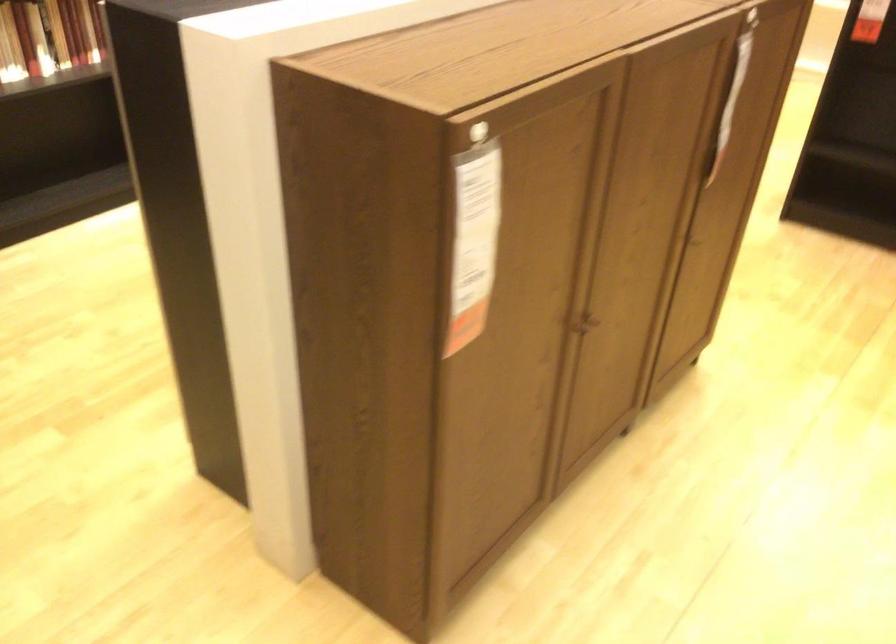
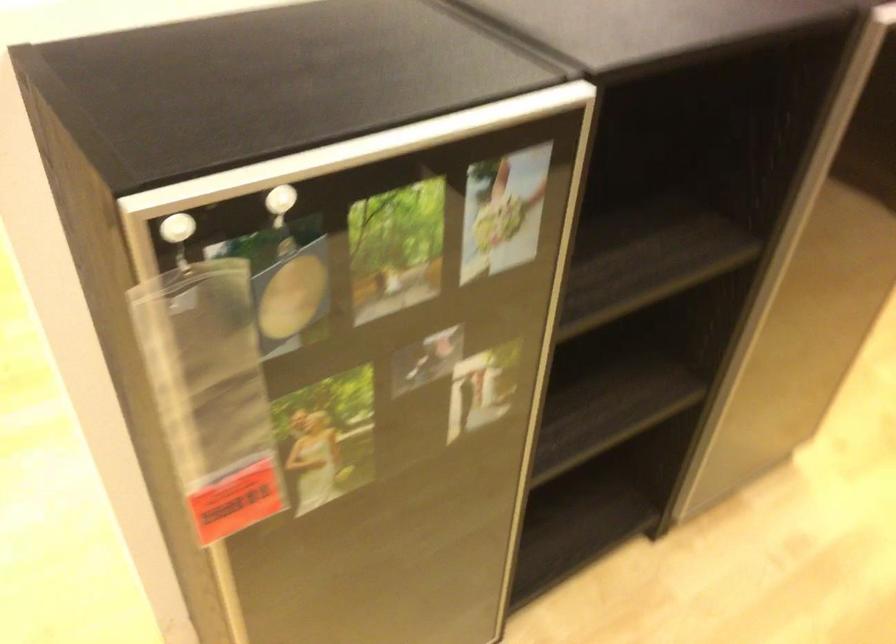
Question: I am providing you with two images of the same scene from different viewpoints. Please identify which objects are invisible in image2.

Choices:
 (A) white circular magnet
 (B) fabric door pull
 (C) silver door frame
 (D) white sheet music

Answer: (B)